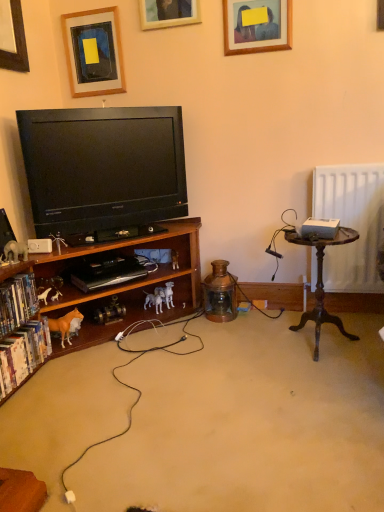
Where is `free spot to the right of woodenmaterial/texture bookcase at left`? This screenshot has width=384, height=512. free spot to the right of woodenmaterial/texture bookcase at left is located at coordinates (265, 371).